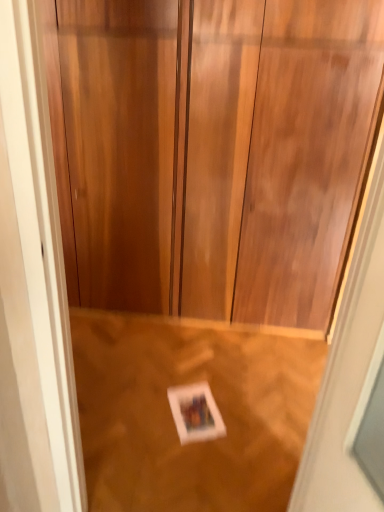
Identify the location of vacant area on top of white paper at center (from a real-world perspective). The image size is (384, 512). click(191, 406).